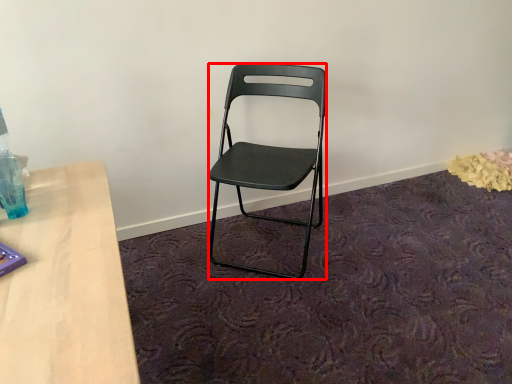
Question: From the image's perspective, what is the correct spatial positioning of chair (annotated by the red box) in reference to bottle?

Choices:
 (A) above
 (B) below

Answer: (A)